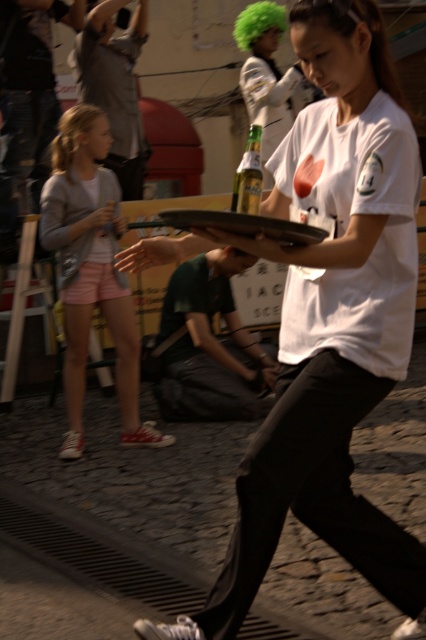
You are standing in front of a camera that is capturing the lively street scene. You want to know if the green wig at upper center is within the camera frame. Can you determine this based on the distance?

The green wig at upper center is 2.77 meters away from the camera, so it is within the camera frame as it is close enough to be captured.

You are a photographer trying to capture a clear shot of both the green wig at upper center and the light pink denim shorts at left. Which object should you focus on first to ensure both are in focus?

You should focus on the green wig at upper center first because it is closer to the viewer than the light pink denim shorts at left, so adjusting focus from near to far will help both be in focus.